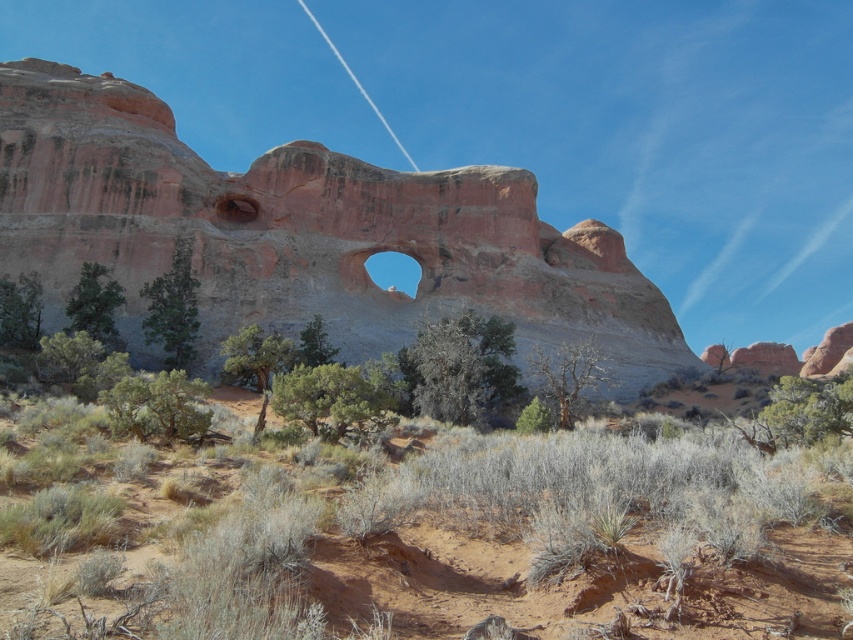
Who is higher up, rustic sandstone arch at center or rustic stone hole at center?

rustic sandstone arch at center is higher up.

Is rustic sandstone arch at center bigger than rustic stone hole at center?

Yes, rustic sandstone arch at center is bigger than rustic stone hole at center.

Between point (91, 84) and point (244, 205), which one is positioned behind?

Point (91, 84)

Find the location of `rustic sandstone arch at center`. rustic sandstone arch at center is located at coordinates (303, 234).

Who is shorter, desert shrubs at center or rustic stone hole at center?

Standing shorter between the two is rustic stone hole at center.

Does desert shrubs at center appear over rustic stone hole at center?

No.

Who is more forward, (682, 529) or (238, 221)?

Point (682, 529) is more forward.

At what (x,y) coordinates should I click in order to perform the action: click on desert shrubs at center. Please return your answer as a coordinate pair (x, y). Looking at the image, I should click on (428, 540).

Does desert shrubs at center have a lesser width compared to rustic sandstone arch at center?

Yes, desert shrubs at center is thinner than rustic sandstone arch at center.

Is desert shrubs at center below rustic sandstone arch at center?

Indeed, desert shrubs at center is positioned under rustic sandstone arch at center.

Find the location of a particular element. The width and height of the screenshot is (853, 640). desert shrubs at center is located at coordinates (428, 540).